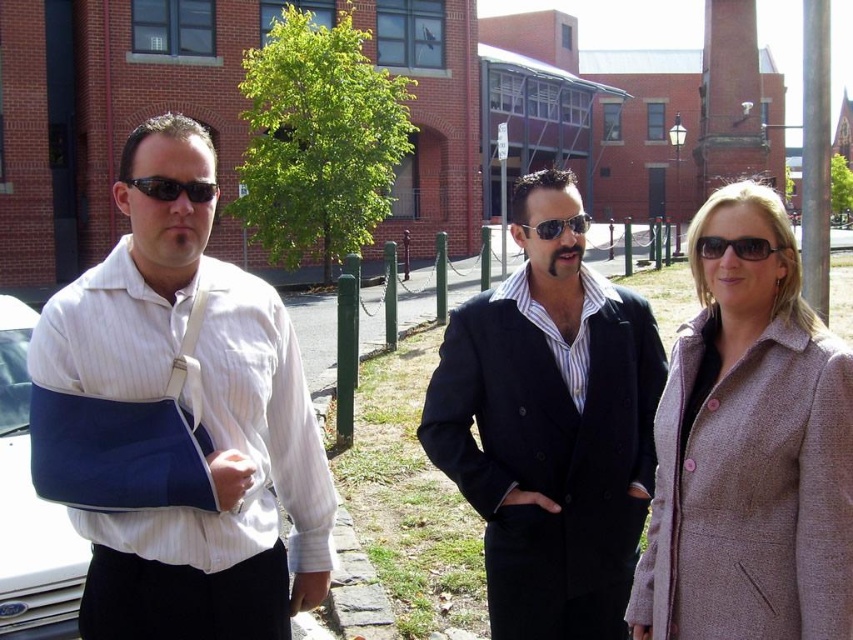
Question: Considering the relative positions of blue fabric arm sling at left and black wool coat at center in the image provided, where is blue fabric arm sling at left located with respect to black wool coat at center?

Choices:
 (A) left
 (B) right

Answer: (A)

Question: Considering the real-world distances, which object is closest to the sunglasses at center?

Choices:
 (A) black plastic sunglasses at center
 (B) blue fabric arm at left
 (C) black wool coat at center
 (D) blue fabric arm sling at left

Answer: (C)

Question: Does blue fabric arm sling at left appear on the left side of sunglasses at center?

Choices:
 (A) no
 (B) yes

Answer: (B)

Question: Observing the image, what is the correct spatial positioning of blue fabric arm sling at left in reference to black wool coat at center?

Choices:
 (A) below
 (B) above

Answer: (A)

Question: Which point is closer to the camera?

Choices:
 (A) sunglasses at center
 (B) black wool coat at center

Answer: (A)

Question: Which of the following is the farthest from the observer?

Choices:
 (A) sunglasses at center
 (B) blue fabric arm at left

Answer: (B)